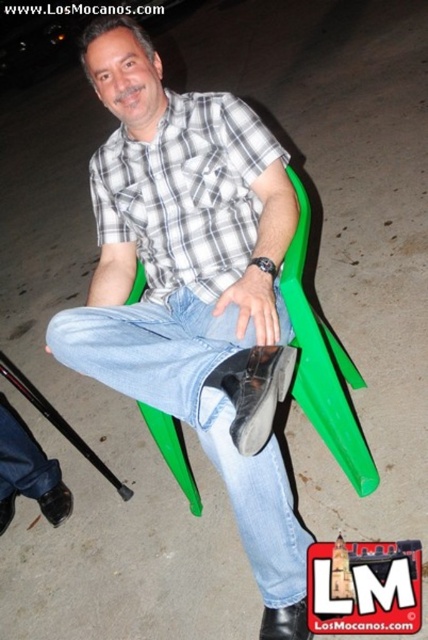
Question: Which of the following is the closest to the observer?

Choices:
 (A) matte plaid shirt at center
 (B) white checkered shirt at center

Answer: (A)

Question: Is matte plaid shirt at center above white checkered shirt at center?

Choices:
 (A) no
 (B) yes

Answer: (A)

Question: Can you confirm if matte plaid shirt at center is positioned above white checkered shirt at center?

Choices:
 (A) no
 (B) yes

Answer: (A)

Question: Considering the relative positions of matte plaid shirt at center and white checkered shirt at center in the image provided, where is matte plaid shirt at center located with respect to white checkered shirt at center?

Choices:
 (A) above
 (B) below

Answer: (B)